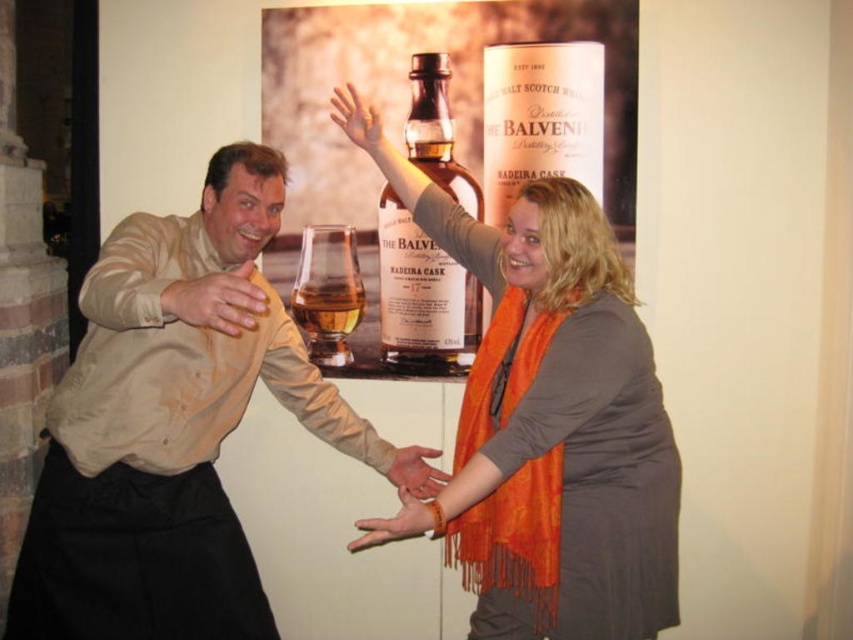
Question: Does matte glass bottle at center appear on the left side of smooth skin hand at upper center?

Choices:
 (A) no
 (B) yes

Answer: (A)

Question: Is the position of matte gray sweater at center more distant than that of matte orange scarf at lower center?

Choices:
 (A) yes
 (B) no

Answer: (B)

Question: Does matte glass bottle at center appear under amber glass at center?

Choices:
 (A) yes
 (B) no

Answer: (B)

Question: Which point appears farthest from the camera in this image?

Choices:
 (A) (380, 124)
 (B) (428, 492)
 (C) (351, 232)
 (D) (202, 301)

Answer: (C)

Question: Which point appears farthest from the camera in this image?

Choices:
 (A) (415, 264)
 (B) (306, 300)
 (C) (294, 380)

Answer: (B)

Question: Which point is closer to the camera?

Choices:
 (A) translucent amber glass at center
 (B) matte beige shirt at center

Answer: (B)